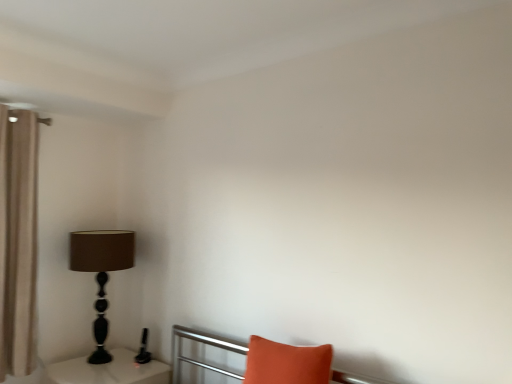
Where is `beige fabric curtain at left`? The width and height of the screenshot is (512, 384). beige fabric curtain at left is located at coordinates [x=18, y=240].

What do you see at coordinates (18, 240) in the screenshot?
I see `beige fabric curtain at left` at bounding box center [18, 240].

Where is `matte black lamp at left`? matte black lamp at left is located at coordinates (101, 272).

Find the location of `beige fabric curtain at left`. beige fabric curtain at left is located at coordinates (18, 240).

Is orange fabric pillow at lower right next to beige fabric curtain at left?

No, orange fabric pillow at lower right is not in contact with beige fabric curtain at left.

Based on the photo, does orange fabric pillow at lower right have a greater width compared to beige fabric curtain at left?

Yes, orange fabric pillow at lower right is wider than beige fabric curtain at left.

Is orange fabric pillow at lower right taller or shorter than beige fabric curtain at left?

In the image, orange fabric pillow at lower right appears to be shorter than beige fabric curtain at left.

From the picture: Does beige fabric curtain at left come behind white glossy table at lower left?

Yes, beige fabric curtain at left is further from the camera.

Based on the photo, is beige fabric curtain at left not close to white glossy table at lower left?

No, beige fabric curtain at left is not far away from white glossy table at lower left.

Does beige fabric curtain at left have a greater height compared to white glossy table at lower left?

Indeed, beige fabric curtain at left has a greater height compared to white glossy table at lower left.

In the scene shown: Can you confirm if beige fabric curtain at left is positioned to the left of white glossy table at lower left?

Indeed, beige fabric curtain at left is positioned on the left side of white glossy table at lower left.

Is orange fabric pillow at lower right next to white glossy table at lower left?

There is a gap between orange fabric pillow at lower right and white glossy table at lower left.

There is a white glossy table at lower left. Find the location of `pillow above it (from a real-world perspective)`. pillow above it (from a real-world perspective) is located at coordinates (286, 363).

How different are the orientations of orange fabric pillow at lower right and white glossy table at lower left in degrees?

2.6 degrees.

Which object is further away from the camera taking this photo, orange fabric pillow at lower right or white glossy table at lower left?

white glossy table at lower left is further from the camera.

Is orange fabric pillow at lower right facing away from matte black lamp at left?

orange fabric pillow at lower right is not turned away from matte black lamp at left.

Can you confirm if orange fabric pillow at lower right is smaller than matte black lamp at left?

Indeed, orange fabric pillow at lower right has a smaller size compared to matte black lamp at left.

Consider the image. Between orange fabric pillow at lower right and matte black lamp at left, which one has larger width?

With larger width is matte black lamp at left.

Image resolution: width=512 pixels, height=384 pixels. What are the coordinates of `lamp above the orange fabric pillow at lower right (from the image's perspective)` in the screenshot? It's located at (101, 272).

Is point (85, 262) more distant than point (138, 381)?

Yes, point (85, 262) is farther from viewer.

You are a GUI agent. You are given a task and a screenshot of the screen. Output one action in this format:
    pyautogui.click(x=<x>, y=<y>)
    Task: Click on the table located below the matte black lamp at left (from the image's perspective)
    
    Given the screenshot: What is the action you would take?
    pyautogui.click(x=109, y=370)

From the image's perspective, relative to white glossy table at lower left, is matte black lamp at left above or below?

From the image's perspective, matte black lamp at left appears above white glossy table at lower left.

Is white glossy table at lower left completely or partially inside matte black lamp at left?

Definitely not — white glossy table at lower left is not inside matte black lamp at left.

Does matte black lamp at left appear on the right side of orange fabric pillow at lower right?

Incorrect, matte black lamp at left is not on the right side of orange fabric pillow at lower right.

In terms of width, does matte black lamp at left look wider or thinner when compared to orange fabric pillow at lower right?

Clearly, matte black lamp at left has more width compared to orange fabric pillow at lower right.

In the scene shown: From the image's perspective, relative to matte black lamp at left, is white glossy table at lower left above or below?

Clearly, from the image's perspective, white glossy table at lower left is below matte black lamp at left.

Considering their positions, is white glossy table at lower left located in front of or behind matte black lamp at left?

Clearly, white glossy table at lower left is in front of matte black lamp at left.

Considering the relative positions of white glossy table at lower left and matte black lamp at left in the image provided, is white glossy table at lower left to the left of matte black lamp at left from the viewer's perspective?

In fact, white glossy table at lower left is to the right of matte black lamp at left.

Considering the points (54, 372) and (94, 336), which point is in front, point (54, 372) or point (94, 336)?

Point (54, 372)

Locate an element on the screen. The height and width of the screenshot is (384, 512). pillow that is in front of the beige fabric curtain at left is located at coordinates (286, 363).

Identify the location of table located below the beige fabric curtain at left (from the image's perspective). point(109,370).

Looking at the image, which one is located further to white glossy table at lower left, orange fabric pillow at lower right or beige fabric curtain at left?

orange fabric pillow at lower right lies further to white glossy table at lower left than the other object.

Based on the photo, considering their positions, is matte black lamp at left positioned further to orange fabric pillow at lower right than white glossy table at lower left?

matte black lamp at left is further to orange fabric pillow at lower right.

Looking at the image, which one is located closer to beige fabric curtain at left, matte black lamp at left or orange fabric pillow at lower right?

The object closer to beige fabric curtain at left is matte black lamp at left.

Estimate the real-world distances between objects in this image. Which object is further from matte black lamp at left, beige fabric curtain at left or orange fabric pillow at lower right?

orange fabric pillow at lower right.

Estimate the real-world distances between objects in this image. Which object is closer to white glossy table at lower left, matte black lamp at left or beige fabric curtain at left?

matte black lamp at left is positioned closer to the anchor white glossy table at lower left.

Estimate the real-world distances between objects in this image. Which object is closer to beige fabric curtain at left, white glossy table at lower left or matte black lamp at left?

Based on the image, matte black lamp at left appears to be nearer to beige fabric curtain at left.

When comparing their distances from white glossy table at lower left, does beige fabric curtain at left or orange fabric pillow at lower right seem further?

orange fabric pillow at lower right.

From the image, which object appears to be farther from matte black lamp at left, beige fabric curtain at left or white glossy table at lower left?

beige fabric curtain at left.

I want to click on lamp between beige fabric curtain at left and white glossy table at lower left vertically, so click(x=101, y=272).

Locate an element on the screen. The image size is (512, 384). table between beige fabric curtain at left and orange fabric pillow at lower right is located at coordinates (109, 370).

Find the location of a particular element. The width and height of the screenshot is (512, 384). lamp between beige fabric curtain at left and orange fabric pillow at lower right is located at coordinates (101, 272).

The image size is (512, 384). I want to click on table located between matte black lamp at left and orange fabric pillow at lower right in the left-right direction, so click(x=109, y=370).